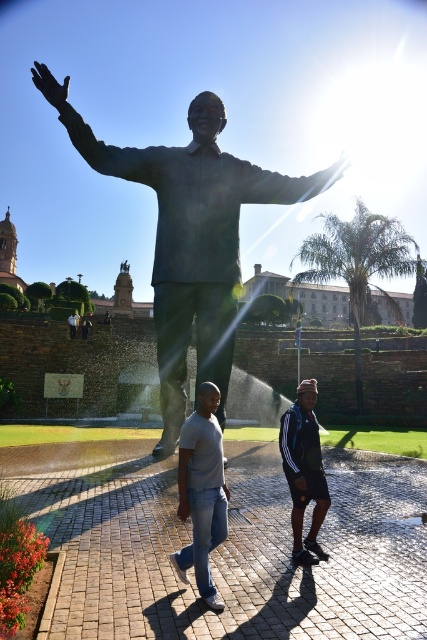
Question: Which point appears farthest from the camera in this image?

Choices:
 (A) (297, 461)
 (B) (173, 326)
 (C) (192, 452)

Answer: (B)

Question: Is bronze statue at center positioned behind light gray t-shirt at center?

Choices:
 (A) yes
 (B) no

Answer: (A)

Question: Can you confirm if bronze statue at center is positioned below light gray t-shirt at center?

Choices:
 (A) no
 (B) yes

Answer: (A)

Question: Which of the following is the farthest from the observer?

Choices:
 (A) (294, 483)
 (B) (181, 275)
 (C) (184, 490)

Answer: (B)

Question: Which point is farther to the camera?

Choices:
 (A) light gray t-shirt at center
 (B) dark blue jersey at center

Answer: (B)

Question: Observing the image, what is the correct spatial positioning of bronze statue at center in reference to light gray t-shirt at center?

Choices:
 (A) right
 (B) left

Answer: (B)